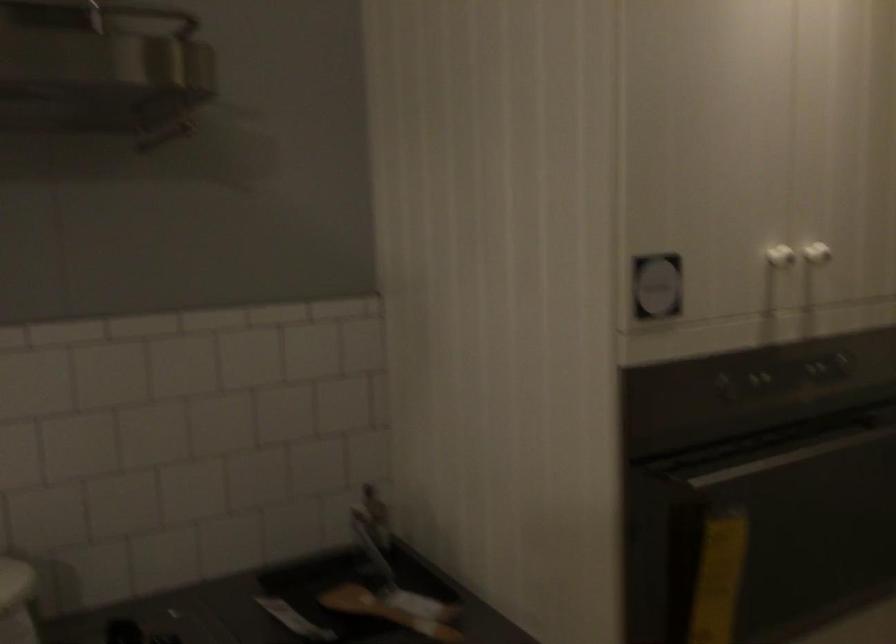
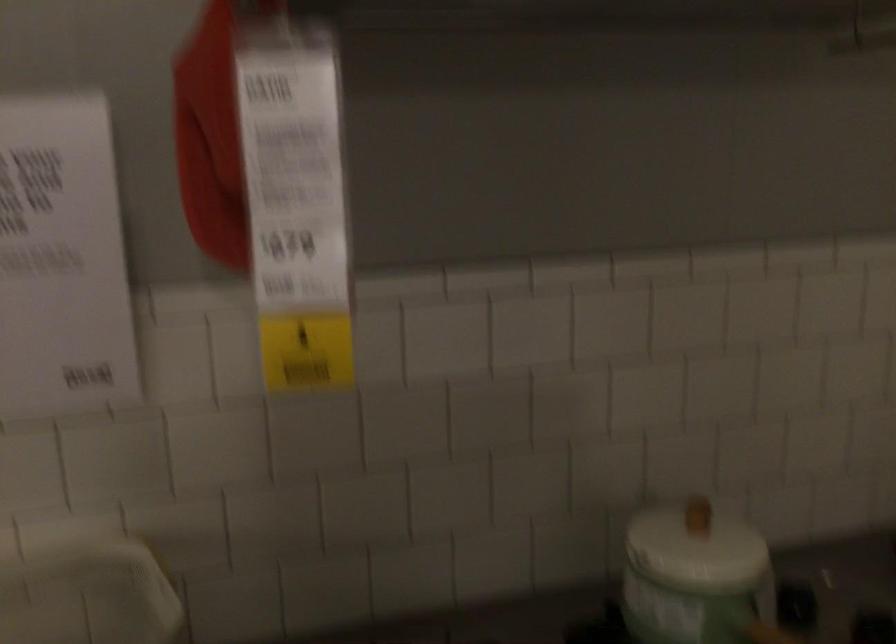
Question: The first image is from the beginning of the video and the second image is from the end. How did the camera likely rotate when shooting the video?

Choices:
 (A) Left
 (B) Right
 (C) Up
 (D) Down

Answer: (A)